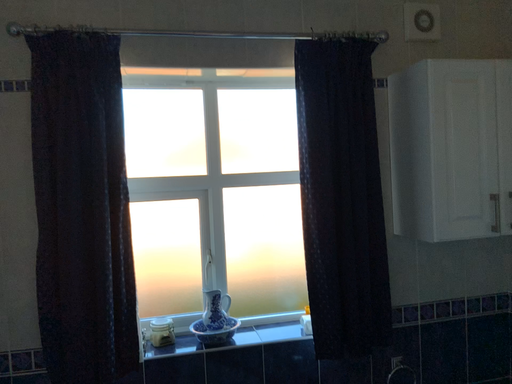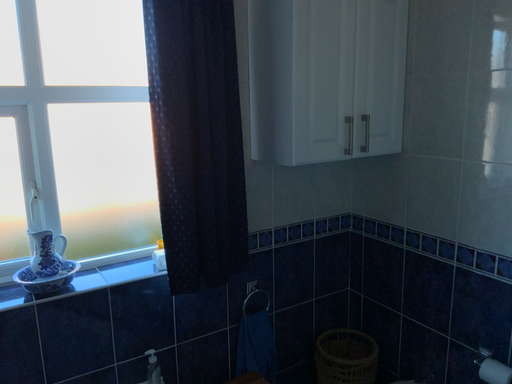
Question: How did the camera likely rotate when shooting the video?

Choices:
 (A) rotated left
 (B) rotated right

Answer: (B)